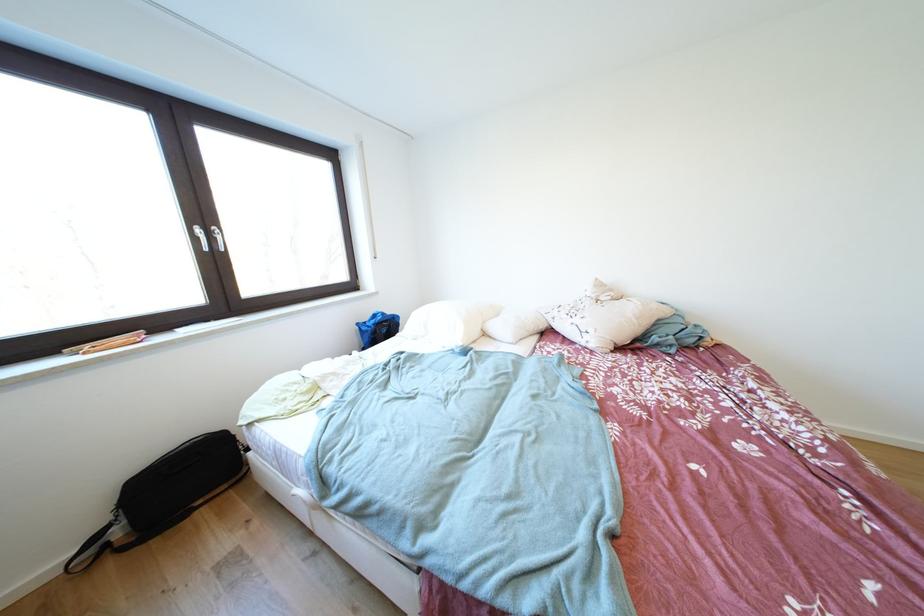
Describe the element at coordinates (92, 546) in the screenshot. Image resolution: width=924 pixels, height=616 pixels. I see `a black bag strap` at that location.